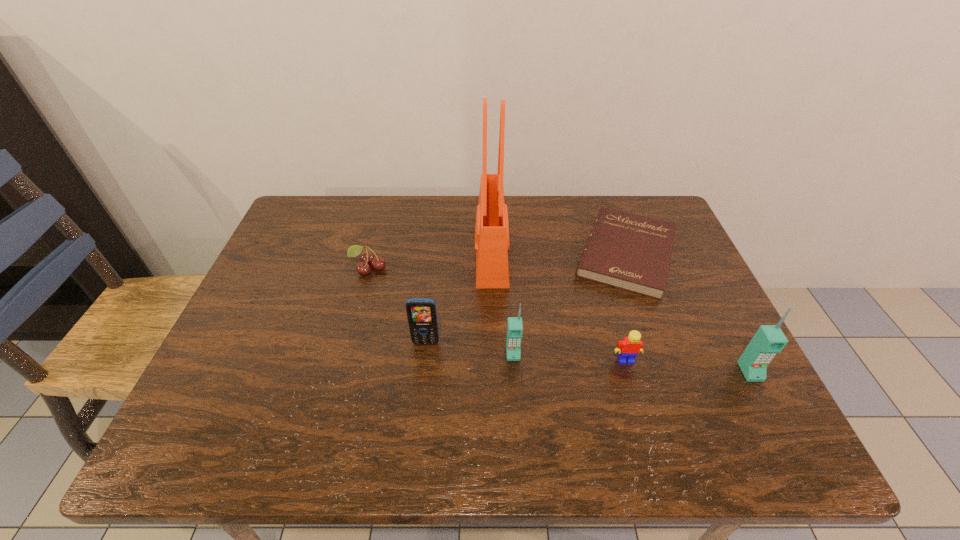
Locate an element on the screen. Image resolution: width=960 pixels, height=540 pixels. cellular telephone that is positioned at the right edge is located at coordinates (769, 339).

This screenshot has width=960, height=540. In order to click on hardback book located in the right edge section of the desktop in this screenshot , I will do pyautogui.click(x=631, y=252).

Locate an element on the screen. This screenshot has width=960, height=540. object present at the far right corner is located at coordinates (631, 252).

Where is `object located in the near right corner section of the desktop`? The width and height of the screenshot is (960, 540). object located in the near right corner section of the desktop is located at coordinates (769, 339).

This screenshot has width=960, height=540. What are the coordinates of `vacant space at the far edge of the desktop` in the screenshot? It's located at (412, 218).

Find the location of a particular element. Image resolution: width=960 pixels, height=540 pixels. vacant space at the near edge of the desktop is located at coordinates (478, 391).

Locate an element on the screen. The image size is (960, 540). vacant space at the left edge of the desktop is located at coordinates (219, 364).

You are a GUI agent. You are given a task and a screenshot of the screen. Output one action in this format:
    pyautogui.click(x=<x>, y=<y>)
    Task: Click on the free space at the far right corner of the desktop
    
    Given the screenshot: What is the action you would take?
    pyautogui.click(x=639, y=208)

The height and width of the screenshot is (540, 960). I want to click on vacant space at the near right corner of the desktop, so click(x=714, y=404).

This screenshot has width=960, height=540. Identify the location of free point between the leftmost cellular telephone and the leftmost object. (397, 306).